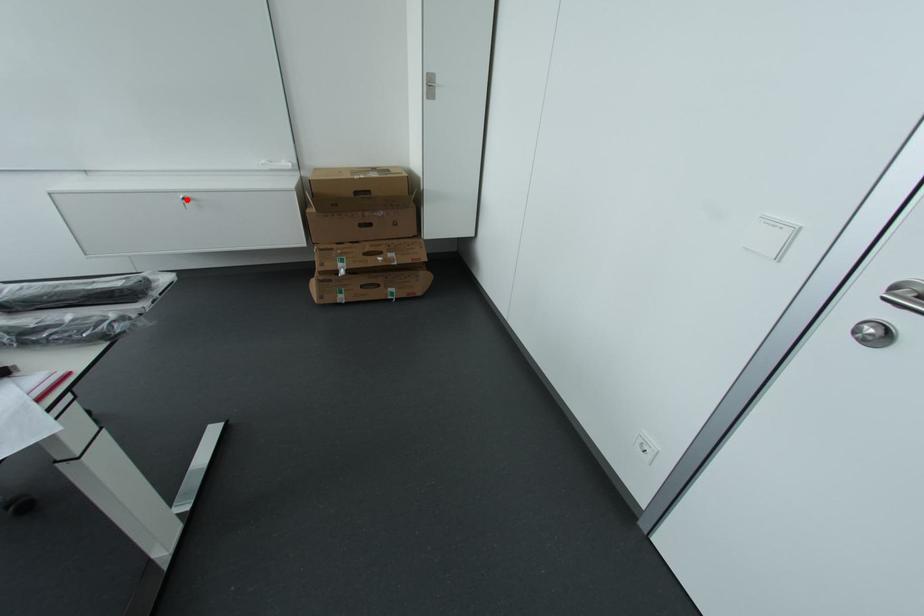
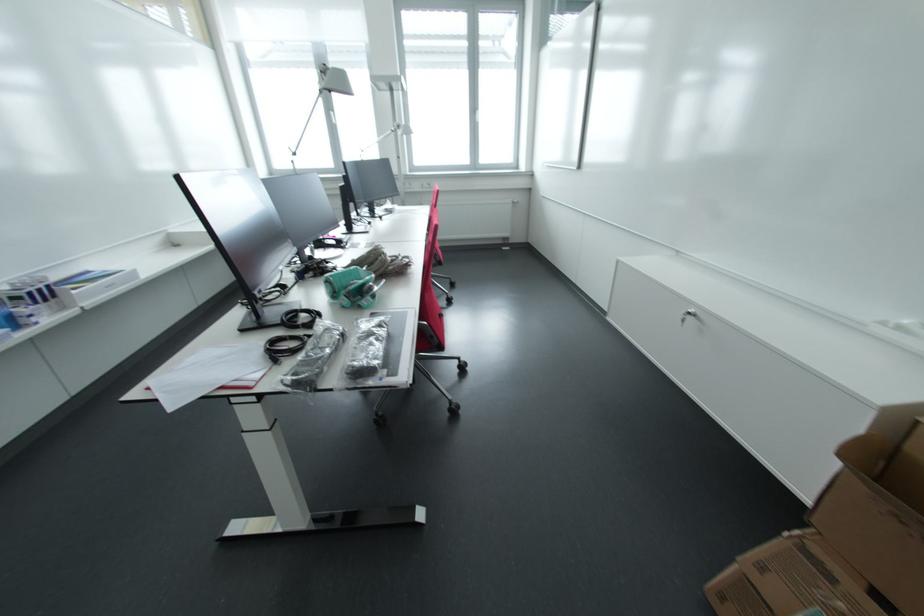
Where in the second image is the point corresponding to the highlighted location from the first image?

(694, 315)